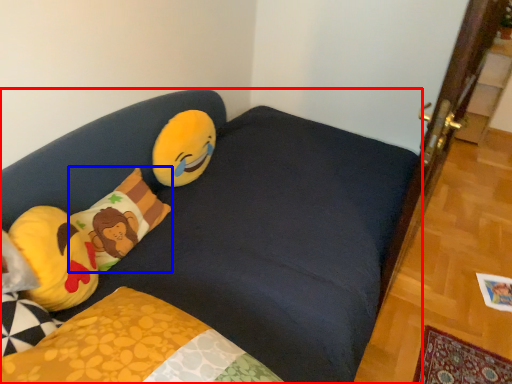
Question: Among these objects, which one is nearest to the camera, studio couch (highlighted by a red box) or pillow (highlighted by a blue box)?

Choices:
 (A) studio couch
 (B) pillow

Answer: (A)